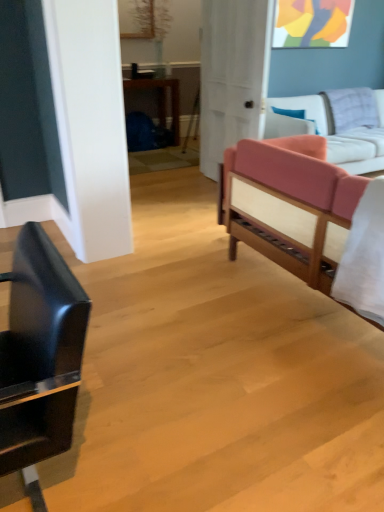
At what (x,y) coordinates should I click in order to perform the action: click on free space in front of pink fabric couch at right, the 1th studio couch when ordered from front to back. Please return your answer as a coordinate pair (x, y). Looking at the image, I should click on (290, 390).